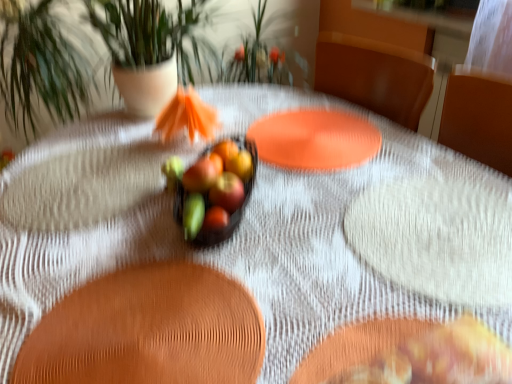
Where is `vacant area situated to the left side of glossy glass bowl at center, which ranks as the third fruit in left-to-right order`? The image size is (512, 384). vacant area situated to the left side of glossy glass bowl at center, which ranks as the third fruit in left-to-right order is located at coordinates (144, 183).